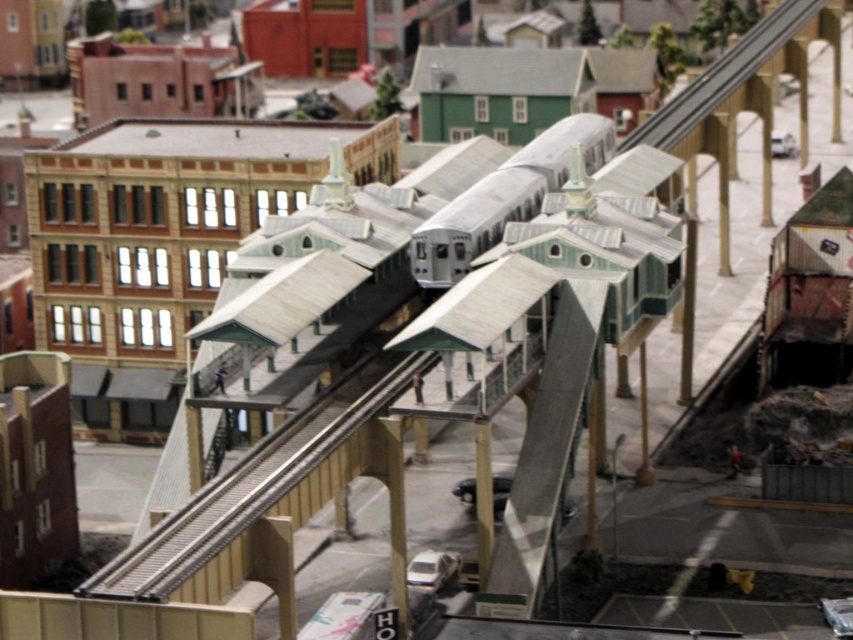
You are a model train enthusiast who wants to place a new train on the tracks. The metallic silver train track at center is part of your layout. Where should you place the silver metallic train at center relative to the track?

The metallic silver train track at center is positioned on the left side of silver metallic train at center, so you should place the silver metallic train at center to the right of the metallic silver train track at center.

You are standing at the entrance of the model train station. You want to place a new decorative tree exactly at the center of the metallic silver train track at center. What coordinates should you aim for?

The coordinates for the metallic silver train track at center are at point (x=253, y=483), so you should aim for those coordinates to place the decorative tree exactly at its center.